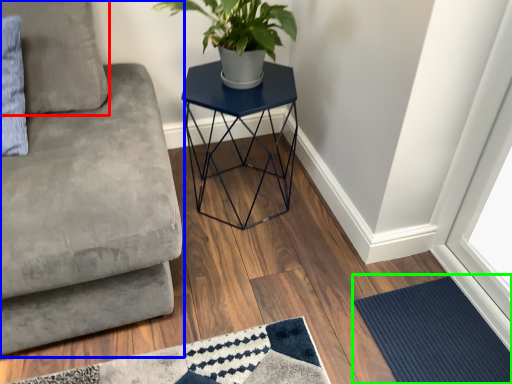
Question: Estimate the real-world distances between objects in this image. Which object is closer to pillow (highlighted by a red box), studio couch (highlighted by a blue box) or doormat (highlighted by a green box)?

Choices:
 (A) studio couch
 (B) doormat

Answer: (A)